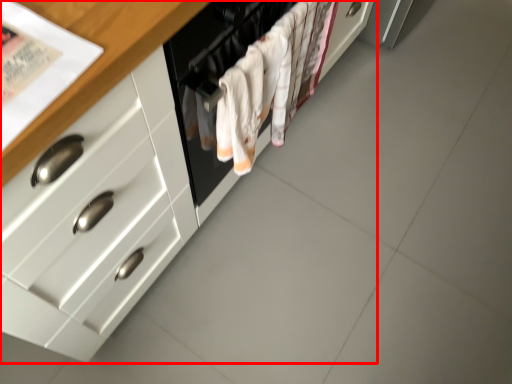
Question: From the image's perspective, considering the relative positions of cabinetry (annotated by the red box) and oven in the image provided, where is cabinetry (annotated by the red box) located with respect to the staircase?

Choices:
 (A) above
 (B) below

Answer: (A)